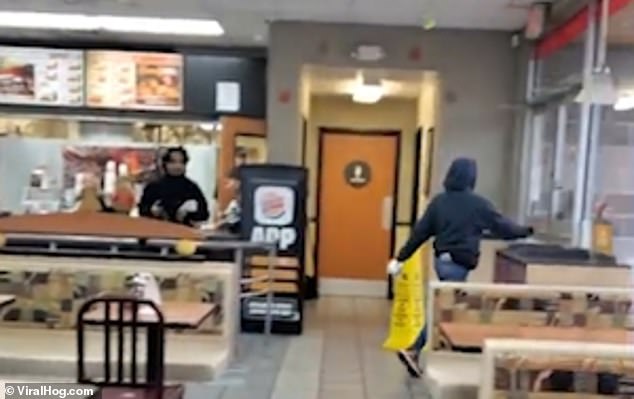
Identify the location of table. (189, 357), (463, 372).